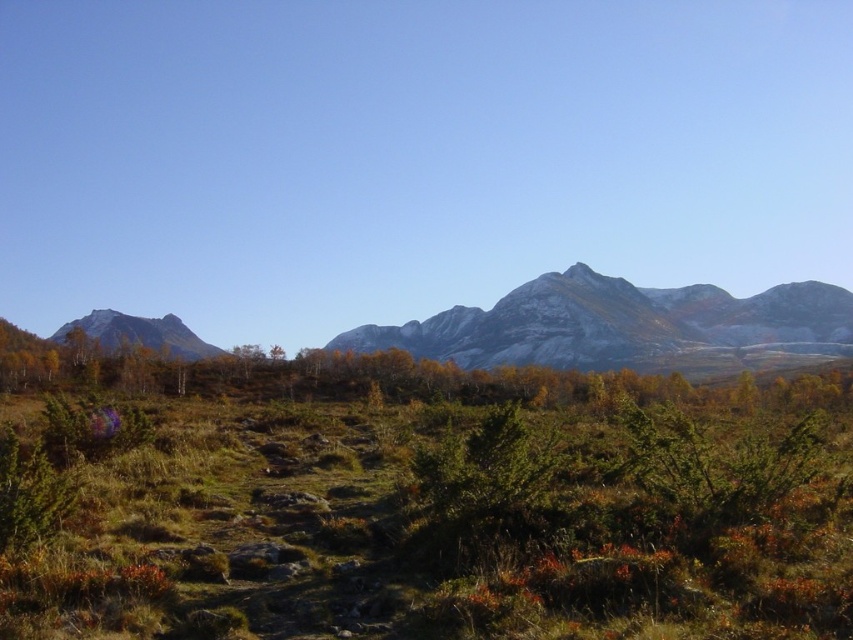
Question: Is rocky gray mountain range at center wider than smooth gray rock at left?

Choices:
 (A) no
 (B) yes

Answer: (B)

Question: Which of these objects is positioned farthest from the green leafy shrub at center?

Choices:
 (A) smooth gray rock at left
 (B) rocky gray mountain range at center

Answer: (B)

Question: Among these points, which one is nearest to the camera?

Choices:
 (A) (170, 376)
 (B) (798, 326)
 (C) (128, 326)

Answer: (A)

Question: Is rocky gray mountain range at center thinner than smooth gray rock at left?

Choices:
 (A) no
 (B) yes

Answer: (A)

Question: Which point appears closest to the camera in this image?

Choices:
 (A) (126, 376)
 (B) (186, 326)

Answer: (A)

Question: Does green leafy shrub at center come in front of smooth gray rock at left?

Choices:
 (A) yes
 (B) no

Answer: (A)